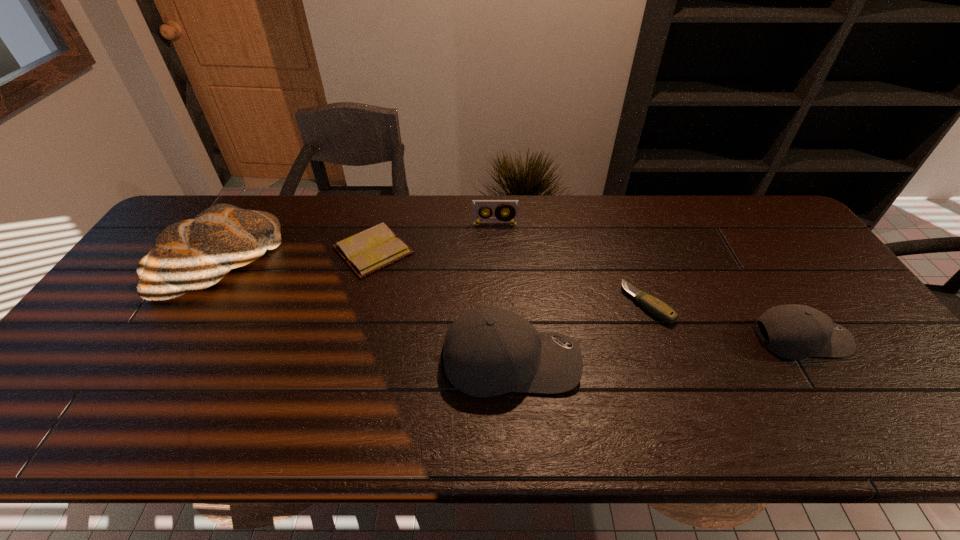
In order to click on empty space that is in between the left baseball cap and the fifth tallest object in this screenshot , I will do `click(579, 333)`.

Where is `unoccupied position between the left baseball cap and the right baseball cap`? unoccupied position between the left baseball cap and the right baseball cap is located at coordinates (655, 349).

I want to click on free point between the videotape and the fifth tallest object, so click(x=571, y=264).

Where is `vacant area between the shorter baseball cap and the diary`? This screenshot has width=960, height=540. vacant area between the shorter baseball cap and the diary is located at coordinates (587, 294).

At what (x,y) coordinates should I click in order to perform the action: click on vacant space that is in between the bread and the rightmost object. Please return your answer as a coordinate pair (x, y). Looking at the image, I should click on (510, 300).

Identify the location of free spot between the pocketknife and the diary. (511, 277).

The image size is (960, 540). In order to click on free point between the bread and the pocketknife in this screenshot , I will do `click(433, 284)`.

The height and width of the screenshot is (540, 960). Identify the location of free space between the left baseball cap and the videotape. (502, 293).

Locate an element on the screen. The image size is (960, 540). object that is the third closest to the left baseball cap is located at coordinates (498, 217).

At what (x,y) coordinates should I click in order to perform the action: click on the third closest object to the shorter baseball cap. Please return your answer as a coordinate pair (x, y). The width and height of the screenshot is (960, 540). Looking at the image, I should click on (498, 217).